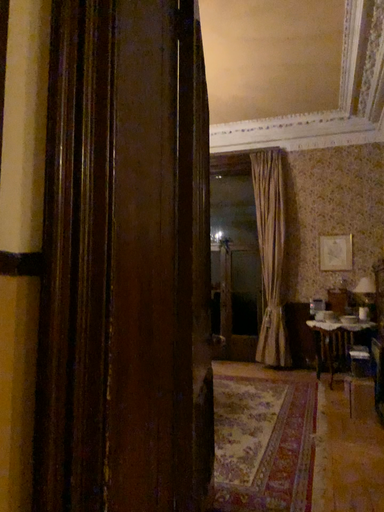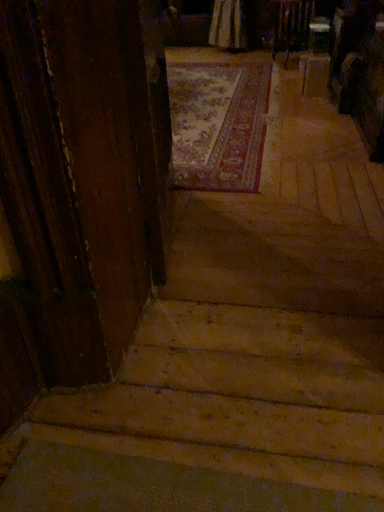
Question: Which way did the camera rotate in the video?

Choices:
 (A) rotated right
 (B) rotated left

Answer: (A)